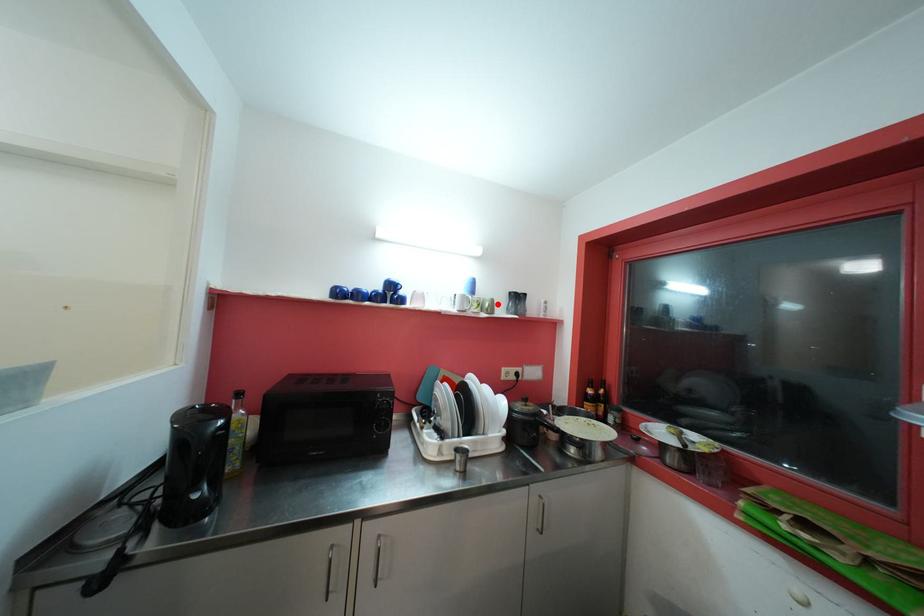
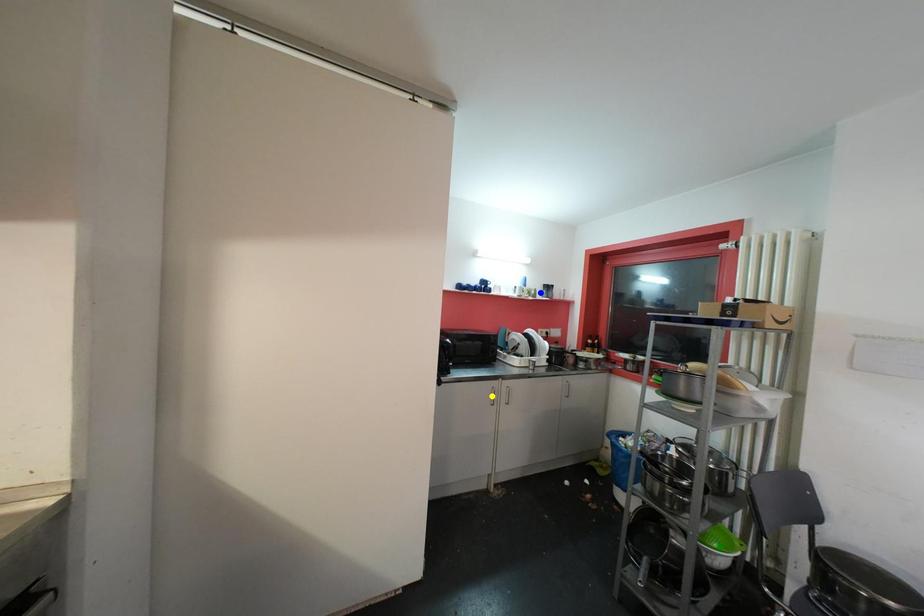
Question: I am providing you with two images of the same scene from different viewpoints. A red point is marked on the first image. You are given multiple points on the second image. Which point in image 2 represents the same 3d spot as the red point in image 1?

Choices:
 (A) blue point
 (B) yellow point
 (C) green point

Answer: (A)